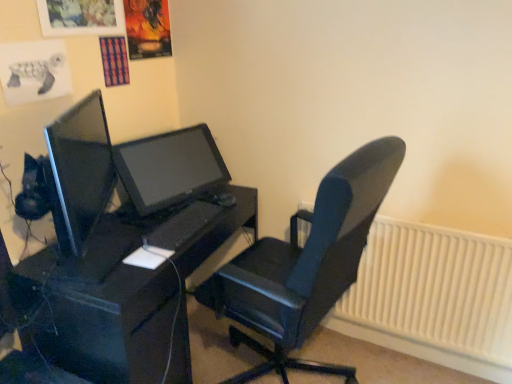
Locate an element on the screen. The height and width of the screenshot is (384, 512). free space above black matte desk at center (from a real-world perspective) is located at coordinates (154, 226).